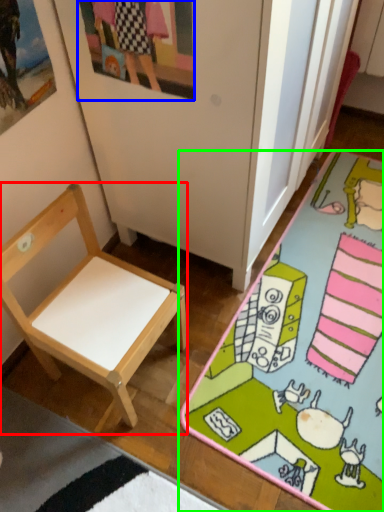
Question: Based on their relative distances, which object is nearer to chair (highlighted by a red box)? Choose from picture frame (highlighted by a blue box) and desk (highlighted by a green box).

Choices:
 (A) picture frame
 (B) desk

Answer: (B)